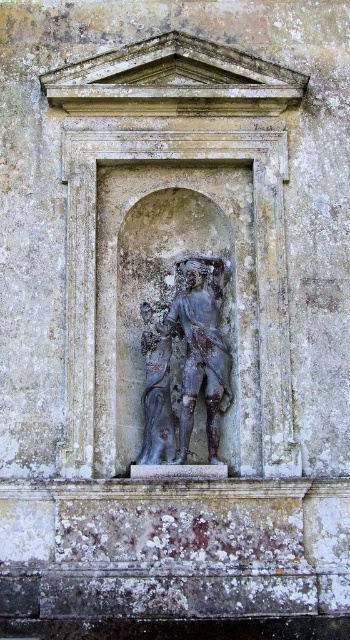
Does bronze statue at center have a lesser width compared to dark gray stone statue at center?

In fact, bronze statue at center might be wider than dark gray stone statue at center.

Does bronze statue at center appear under dark gray stone statue at center?

Actually, bronze statue at center is above dark gray stone statue at center.

Where is `bronze statue at center`? bronze statue at center is located at coordinates (200, 348).